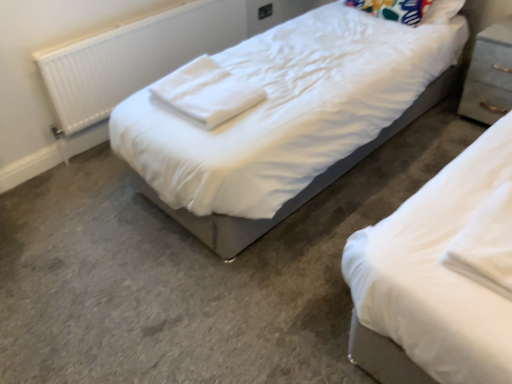
Describe the element at coordinates (206, 92) in the screenshot. Image resolution: width=512 pixels, height=384 pixels. I see `white cotton cloth at center` at that location.

Identify the location of multicolored fabric pillow at upper right. (410, 10).

Who is bigger, white cotton cloth at center or light gray wood nightstand at right?

light gray wood nightstand at right.

Based on the photo, is white cotton cloth at center located outside light gray wood nightstand at right?

Absolutely, white cotton cloth at center is external to light gray wood nightstand at right.

Between white cotton cloth at center and light gray wood nightstand at right, which one appears on the left side from the viewer's perspective?

white cotton cloth at center.

Can you confirm if white cotton cloth at center is positioned to the left of white plastic radiator at left?

In fact, white cotton cloth at center is to the right of white plastic radiator at left.

Based on the photo, between white cotton cloth at center and white plastic radiator at left, which one has more height?

white plastic radiator at left is taller.

Considering the sizes of objects white cotton cloth at center and white plastic radiator at left in the image provided, who is bigger, white cotton cloth at center or white plastic radiator at left?

Bigger between the two is white plastic radiator at left.

Is white cotton cloth at center located outside white plastic radiator at left?

white cotton cloth at center lies outside white plastic radiator at left's area.

Would you say light gray wood nightstand at right is inside or outside white cotton cloth at center?

light gray wood nightstand at right is not enclosed by white cotton cloth at center.

Between point (488, 103) and point (161, 86), which one is positioned behind?

The point (488, 103) is farther from the camera.

Would you say light gray wood nightstand at right is a long distance from white cotton cloth at center?

Indeed, light gray wood nightstand at right is not near white cotton cloth at center.

Is multicolored fabric pillow at upper right bigger than white cotton cloth at center?

Yes.

From the image's perspective, is multicolored fabric pillow at upper right located above or below white cotton cloth at center?

multicolored fabric pillow at upper right is above white cotton cloth at center.

Does multicolored fabric pillow at upper right have a lesser height compared to white cotton cloth at center?

No.

Does point (439, 21) come behind point (199, 94)?

Yes, it is.

Relative to multicolored fabric pillow at upper right, is white plastic radiator at left in front or behind?

white plastic radiator at left is positioned closer to the viewer than multicolored fabric pillow at upper right.

Based on their positions, is white plastic radiator at left located to the left or right of multicolored fabric pillow at upper right?

Based on their positions, white plastic radiator at left is located to the left of multicolored fabric pillow at upper right.

How many degrees apart are the facing directions of white plastic radiator at left and multicolored fabric pillow at upper right?

The facing directions of white plastic radiator at left and multicolored fabric pillow at upper right are 85.6 degrees apart.

In terms of size, does white plastic radiator at left appear bigger or smaller than multicolored fabric pillow at upper right?

In the image, white plastic radiator at left appears to be larger than multicolored fabric pillow at upper right.

Is multicolored fabric pillow at upper right in front of or behind white plastic radiator at left in the image?

Visually, multicolored fabric pillow at upper right is located behind white plastic radiator at left.

Is multicolored fabric pillow at upper right to the right of white plastic radiator at left from the viewer's perspective?

Indeed, multicolored fabric pillow at upper right is positioned on the right side of white plastic radiator at left.

Which of these two, multicolored fabric pillow at upper right or white plastic radiator at left, is thinner?

With smaller width is white plastic radiator at left.

Is multicolored fabric pillow at upper right far from white plastic radiator at left?

Yes.

Is white cotton cloth at center directly adjacent to multicolored fabric pillow at upper right?

They are not placed beside each other.

Based on the photo, based on their positions, is white cotton cloth at center located to the left or right of multicolored fabric pillow at upper right?

white cotton cloth at center is positioned on multicolored fabric pillow at upper right's left side.

Is multicolored fabric pillow at upper right at the back of white cotton cloth at center?

Absolutely, white cotton cloth at center is directed away from multicolored fabric pillow at upper right.

From the image's perspective, between white cotton cloth at center and multicolored fabric pillow at upper right, who is located below?

white cotton cloth at center, from the image's perspective.

This screenshot has height=384, width=512. Identify the location of nightstand located underneath the white cotton cloth at center (from a real-world perspective). (489, 75).

The height and width of the screenshot is (384, 512). I want to click on radiator located on the left of white cotton cloth at center, so click(x=133, y=57).

When comparing their distances from light gray wood nightstand at right, does white cotton cloth at center or multicolored fabric pillow at upper right seem further?

white cotton cloth at center is positioned further to the anchor light gray wood nightstand at right.

Considering their positions, is light gray wood nightstand at right positioned closer to multicolored fabric pillow at upper right than white plastic radiator at left?

light gray wood nightstand at right is closer to multicolored fabric pillow at upper right.

When comparing their distances from light gray wood nightstand at right, does white plastic radiator at left or white cotton cloth at center seem closer?

Based on the image, white cotton cloth at center appears to be nearer to light gray wood nightstand at right.

Based on their spatial positions, is white cotton cloth at center or light gray wood nightstand at right closer to white plastic radiator at left?

white cotton cloth at center.

Estimate the real-world distances between objects in this image. Which object is further from white cotton cloth at center, multicolored fabric pillow at upper right or light gray wood nightstand at right?

Among the two, light gray wood nightstand at right is located further to white cotton cloth at center.

Which object lies further to the anchor point light gray wood nightstand at right, white plastic radiator at left or multicolored fabric pillow at upper right?

The object further to light gray wood nightstand at right is white plastic radiator at left.

Based on their spatial positions, is white cotton cloth at center or white plastic radiator at left closer to multicolored fabric pillow at upper right?

white cotton cloth at center is positioned closer to the anchor multicolored fabric pillow at upper right.

Looking at this image, considering their positions, is white plastic radiator at left positioned further to multicolored fabric pillow at upper right than light gray wood nightstand at right?

Based on the image, white plastic radiator at left appears to be further to multicolored fabric pillow at upper right.

Identify the location of cloth between white plastic radiator at left and multicolored fabric pillow at upper right. (206, 92).

I want to click on pillow between white plastic radiator at left and light gray wood nightstand at right in the horizontal direction, so tap(410, 10).

At what (x,y) coordinates should I click in order to perform the action: click on cloth situated between white plastic radiator at left and light gray wood nightstand at right from left to right. Please return your answer as a coordinate pair (x, y). Looking at the image, I should click on (206, 92).

The image size is (512, 384). I want to click on pillow situated between white cotton cloth at center and light gray wood nightstand at right from left to right, so click(410, 10).